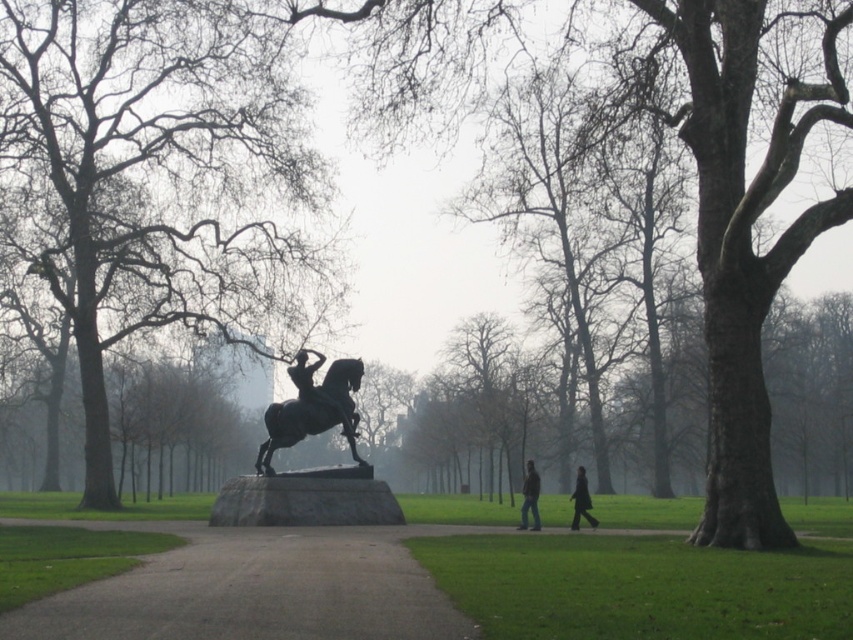
Question: Does smooth concrete path at center have a smaller size compared to polished bronze statue at center?

Choices:
 (A) yes
 (B) no

Answer: (B)

Question: Considering the real-world distances, which object is closest to the shiny bronze horse at center?

Choices:
 (A) polished bronze statue at center
 (B) smooth bark tree at center
 (C) dark gray jeans at center
 (D) smooth concrete path at center

Answer: (A)

Question: Which point appears closest to the camera in this image?

Choices:
 (A) (306, 419)
 (B) (526, 506)
 (C) (346, 410)
 (D) (183, 298)

Answer: (B)

Question: Can you confirm if shiny bronze horse at center is positioned above dark matte coat at lower right?

Choices:
 (A) no
 (B) yes

Answer: (B)

Question: In this image, where is shiny bronze horse at center located relative to dark matte coat at lower right?

Choices:
 (A) above
 (B) below

Answer: (A)

Question: Based on their relative distances, which object is farther from the dark gray jeans at center?

Choices:
 (A) smooth bark tree at center
 (B) smooth concrete path at center
 (C) shiny bronze horse at center
 (D) dark matte coat at lower right

Answer: (A)